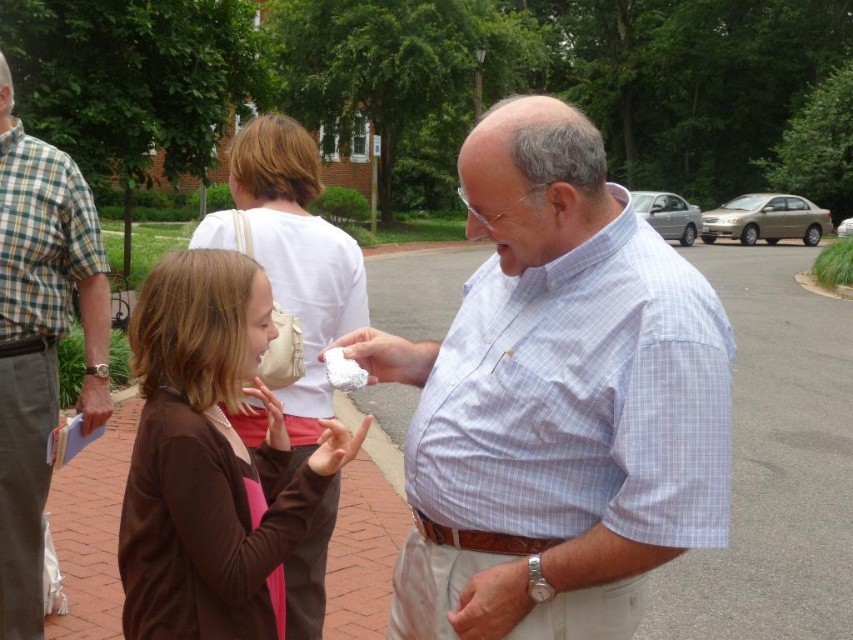
Is light blue checkered shirt at center shorter than white fluffy cloud at center?

No.

Is light blue checkered shirt at center smaller than white fluffy cloud at center?

Actually, light blue checkered shirt at center might be larger than white fluffy cloud at center.

Is point (618, 284) closer to camera compared to point (349, 376)?

Yes.

The width and height of the screenshot is (853, 640). Identify the location of light blue checkered shirt at center. (556, 401).

I want to click on checkered fabric shirt at left, so click(39, 342).

In the scene shown: Is checkered fabric shirt at left wider than white fluffy cloud at center?

Indeed, checkered fabric shirt at left has a greater width compared to white fluffy cloud at center.

Between point (18, 442) and point (335, 356), which one is positioned in front?

Point (335, 356) is more forward.

You are a GUI agent. You are given a task and a screenshot of the screen. Output one action in this format:
    pyautogui.click(x=<x>, y=<y>)
    Task: Click on the checkered fabric shirt at left
    
    Given the screenshot: What is the action you would take?
    [x=39, y=342]

Who is more distant from viewer, (285,600) or (21,502)?

Positioned behind is point (21,502).

Consider the image. Does brown matte sweater at center come in front of checkered fabric shirt at left?

Yes, brown matte sweater at center is in front of checkered fabric shirt at left.

The image size is (853, 640). In order to click on brown matte sweater at center in this screenshot , I will do `click(212, 460)`.

Find the location of a particular element. The image size is (853, 640). brown matte sweater at center is located at coordinates (212, 460).